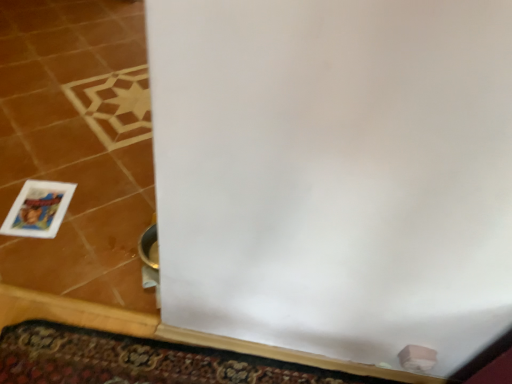
You are a GUI agent. You are given a task and a screenshot of the screen. Output one action in this format:
    pyautogui.click(x=<x>, y=<y>)
    Task: Click on the carpeted doormat at lower center
    The image size is (512, 384).
    Given the screenshot: What is the action you would take?
    pyautogui.click(x=136, y=360)

What do you see at coordinates (136, 360) in the screenshot? I see `carpeted doormat at lower center` at bounding box center [136, 360].

In order to face carpeted doormat at lower center, should I rotate leftwards or rightwards?

A 8.200 degree turn to the left will do.

Based on the photo, measure the distance between point (117, 375) and camera.

Point (117, 375) and camera are 1.31 meters apart from each other.

Describe the element at coordinates (38, 209) in the screenshot. Image resolution: width=512 pixels, height=384 pixels. I see `matte plastic picture frame at lower left` at that location.

Locate an element on the screen. This screenshot has width=512, height=384. matte plastic picture frame at lower left is located at coordinates (38, 209).

Find the location of a particular element. carpeted doormat at lower center is located at coordinates (136, 360).

Which is more to the right, matte plastic picture frame at lower left or carpeted doormat at lower center?

carpeted doormat at lower center.

Considering their positions, is matte plastic picture frame at lower left located in front of or behind carpeted doormat at lower center?

matte plastic picture frame at lower left is behind carpeted doormat at lower center.

Considering the points (44, 216) and (223, 364), which point is behind, point (44, 216) or point (223, 364)?

Positioned behind is point (44, 216).

From the image's perspective, is matte plastic picture frame at lower left located above carpeted doormat at lower center?

Yes, from the image's perspective, matte plastic picture frame at lower left is over carpeted doormat at lower center.

Consider the image. From a real-world perspective, between matte plastic picture frame at lower left and carpeted doormat at lower center, who is vertically lower?

From a 3D spatial view, matte plastic picture frame at lower left is below.

In terms of width, does matte plastic picture frame at lower left look wider or thinner when compared to carpeted doormat at lower center?

Considering their sizes, matte plastic picture frame at lower left looks broader than carpeted doormat at lower center.

Which of these two, matte plastic picture frame at lower left or carpeted doormat at lower center, stands taller?

Standing taller between the two is matte plastic picture frame at lower left.

Considering the sizes of objects matte plastic picture frame at lower left and carpeted doormat at lower center in the image provided, who is bigger, matte plastic picture frame at lower left or carpeted doormat at lower center?

With larger size is carpeted doormat at lower center.

Is matte plastic picture frame at lower left spatially inside carpeted doormat at lower center, or outside of it?

matte plastic picture frame at lower left is not inside carpeted doormat at lower center, it's outside.

Does matte plastic picture frame at lower left touch carpeted doormat at lower center?

No, matte plastic picture frame at lower left is not with carpeted doormat at lower center.

Could you tell me if matte plastic picture frame at lower left is facing carpeted doormat at lower center?

No.

Image resolution: width=512 pixels, height=384 pixels. I want to click on picture frame that appears below the carpeted doormat at lower center (from a real-world perspective), so click(38, 209).

Can you confirm if carpeted doormat at lower center is positioned to the left of matte plastic picture frame at lower left?

No, carpeted doormat at lower center is not to the left of matte plastic picture frame at lower left.

Who is more distant, carpeted doormat at lower center or matte plastic picture frame at lower left?

matte plastic picture frame at lower left is further away from the camera.

Does point (216, 376) come in front of point (5, 232)?

That is True.

From the image's perspective, between carpeted doormat at lower center and matte plastic picture frame at lower left, who is located below?

From the image's view, carpeted doormat at lower center is below.

From a real-world perspective, which object stands above the other?

From a 3D spatial view, carpeted doormat at lower center is above.

Between carpeted doormat at lower center and matte plastic picture frame at lower left, which one has smaller width?

Thinner between the two is carpeted doormat at lower center.

Considering the relative sizes of carpeted doormat at lower center and matte plastic picture frame at lower left in the image provided, is carpeted doormat at lower center shorter than matte plastic picture frame at lower left?

Yes.

Who is smaller, carpeted doormat at lower center or matte plastic picture frame at lower left?

matte plastic picture frame at lower left is smaller.

Is carpeted doormat at lower center not inside matte plastic picture frame at lower left?

carpeted doormat at lower center is positioned outside matte plastic picture frame at lower left.

Is carpeted doormat at lower center with matte plastic picture frame at lower left?

No.

Could you tell me if carpeted doormat at lower center is facing matte plastic picture frame at lower left?

No, carpeted doormat at lower center does not turn towards matte plastic picture frame at lower left.

Locate an element on the screen. doormat lying on the right of matte plastic picture frame at lower left is located at coordinates (136, 360).

Identify the location of picture frame that is above the carpeted doormat at lower center (from the image's perspective). (38, 209).

You are a GUI agent. You are given a task and a screenshot of the screen. Output one action in this format:
    pyautogui.click(x=<x>, y=<y>)
    Task: Click on the doormat above the matte plastic picture frame at lower left (from a real-world perspective)
    This screenshot has width=512, height=384.
    Given the screenshot: What is the action you would take?
    tap(136, 360)